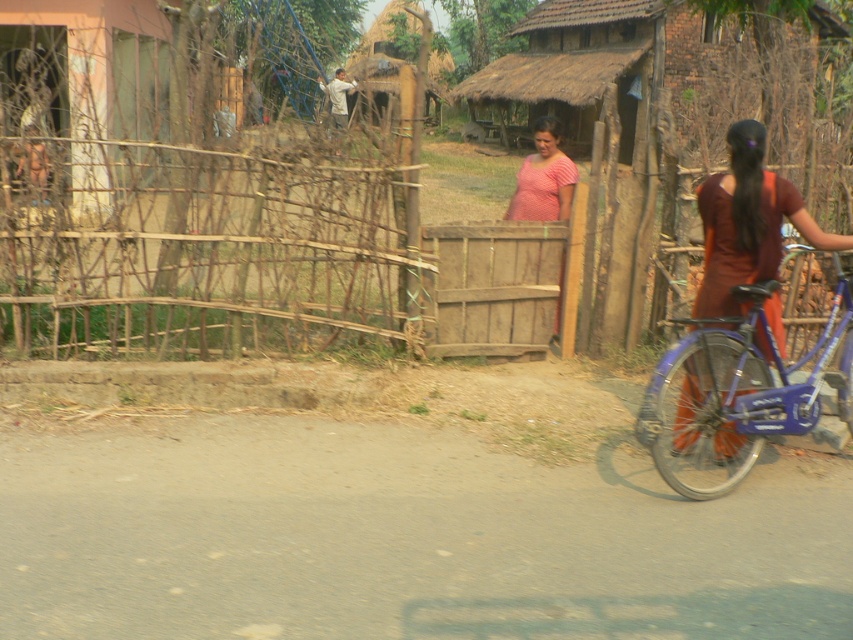
Question: Estimate the real-world distances between objects in this image. Which object is farther from the maroon fabric dress at right?

Choices:
 (A) pink striped shirt at center
 (B) bare wood fence at left

Answer: (B)

Question: Which object is the farthest from the bare wood fence at left?

Choices:
 (A) maroon fabric dress at right
 (B) pink striped shirt at center

Answer: (A)

Question: From the image, what is the correct spatial relationship of maroon fabric dress at right in relation to pink striped shirt at center?

Choices:
 (A) right
 (B) left

Answer: (A)

Question: Where is maroon fabric dress at right located in relation to pink striped shirt at center in the image?

Choices:
 (A) above
 (B) below

Answer: (B)

Question: Which of the following is the farthest from the observer?

Choices:
 (A) (695, 296)
 (B) (196, 157)
 (C) (549, 164)

Answer: (C)

Question: Does bare wood fence at left appear on the right side of pink striped shirt at center?

Choices:
 (A) yes
 (B) no

Answer: (B)